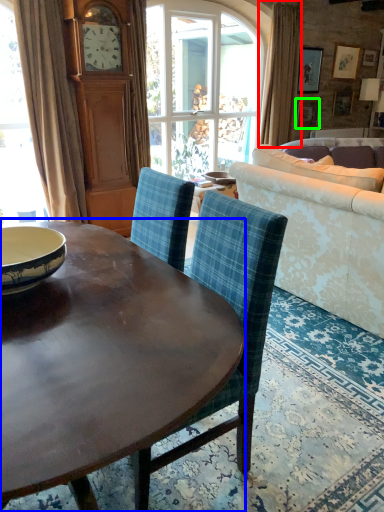
Question: Estimate the real-world distances between objects in this image. Which object is farther from curtain (highlighted by a red box), coffee table (highlighted by a blue box) or picture frame (highlighted by a green box)?

Choices:
 (A) coffee table
 (B) picture frame

Answer: (A)